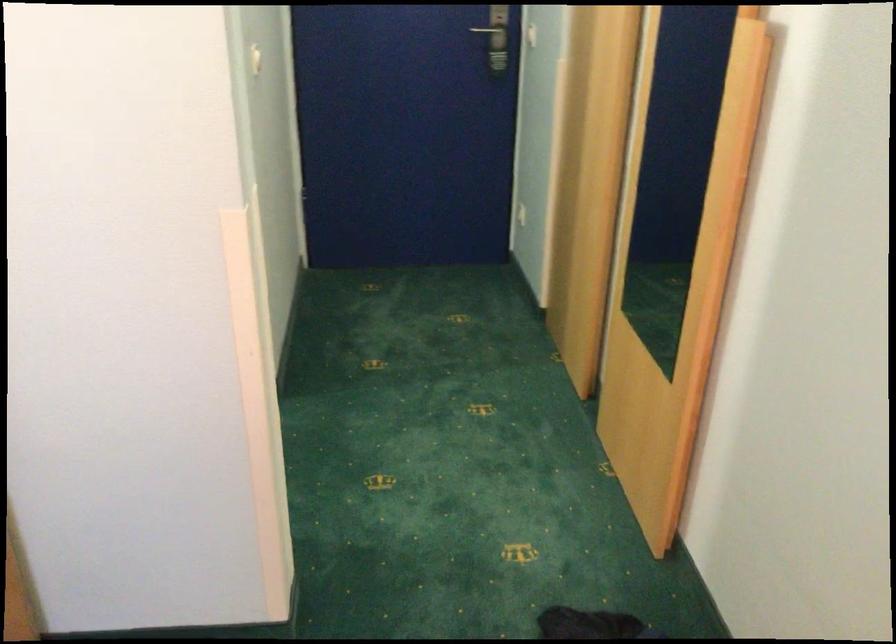
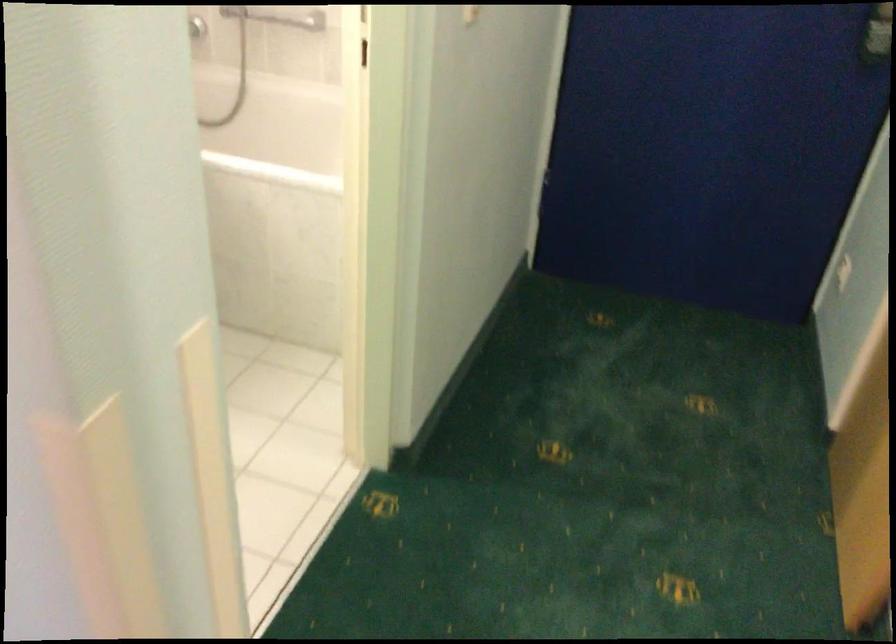
Question: The camera is either moving clockwise (left) or counter-clockwise (right) around the object. The first image is from the beginning of the video and the second image is from the end. Is the camera moving left or right when shooting the video?

Choices:
 (A) Left
 (B) Right

Answer: (B)